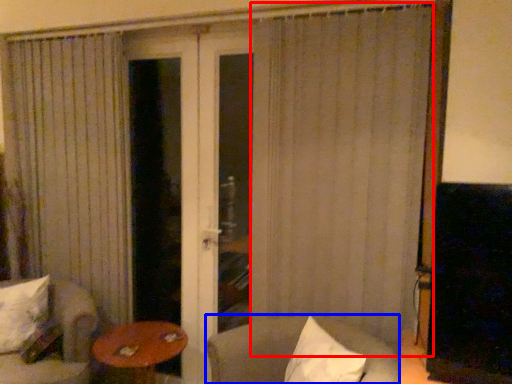
Question: Which object is further to the camera taking this photo, curtain (highlighted by a red box) or chair (highlighted by a blue box)?

Choices:
 (A) curtain
 (B) chair

Answer: (A)